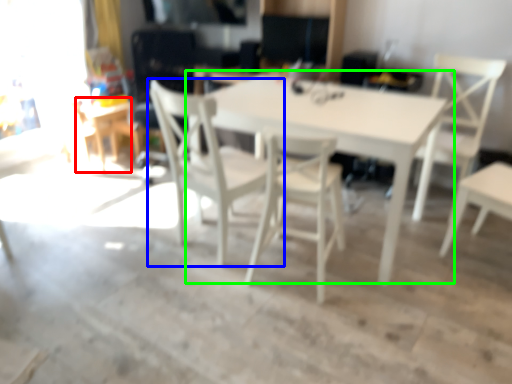
Question: Estimate the real-world distances between objects in this image. Which object is closer to table (highlighted by a red box), chair (highlighted by a blue box) or table (highlighted by a green box)?

Choices:
 (A) chair
 (B) table

Answer: (A)